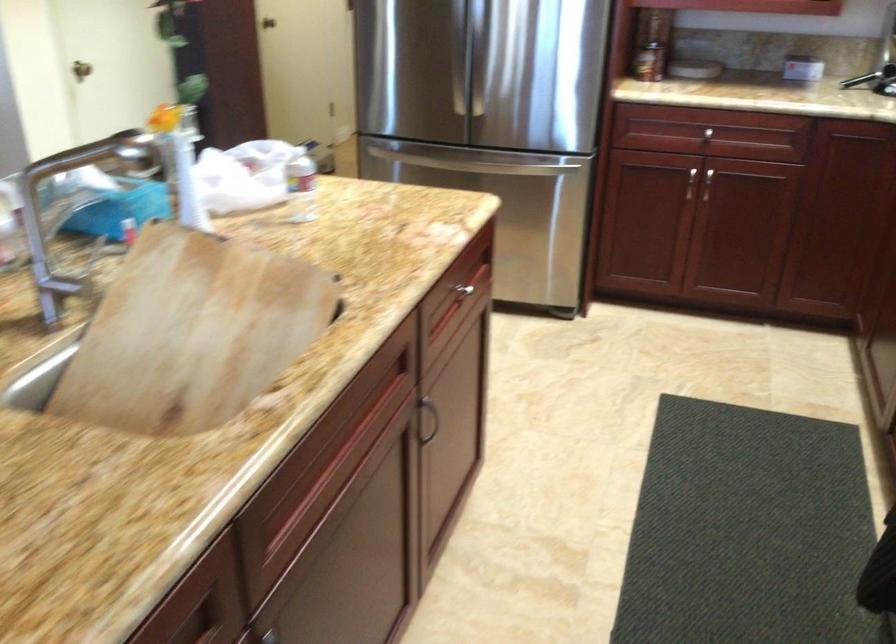
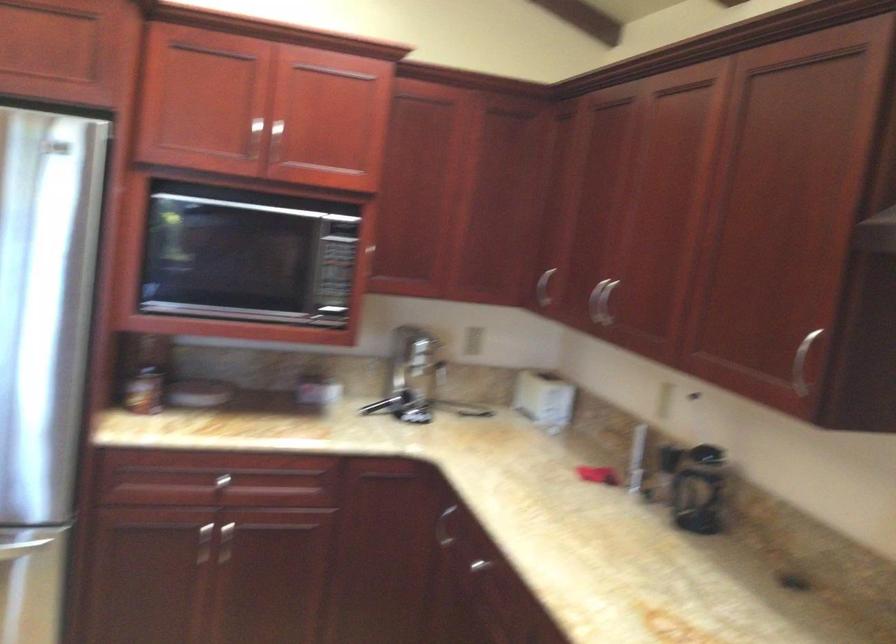
In the second image, find the point that corresponds to [700,182] in the first image.

(222, 543)